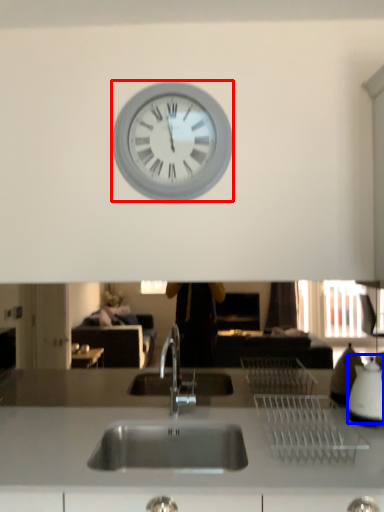
Question: Which of the following is the farthest to the observer, wall clock (highlighted by a red box) or appliance (highlighted by a blue box)?

Choices:
 (A) wall clock
 (B) appliance

Answer: (A)